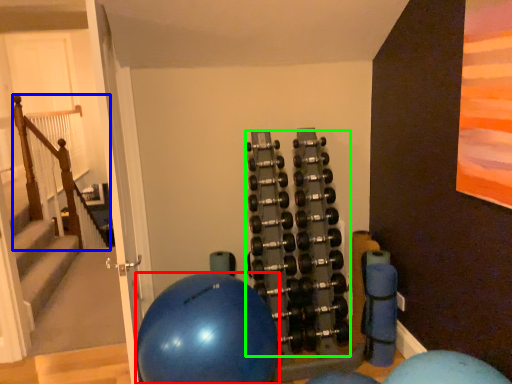
Question: Based on their relative distances, which object is nearer to ball (highlighted by a red box)? Choose from rail (highlighted by a blue box) and dumbbell (highlighted by a green box).

Choices:
 (A) rail
 (B) dumbbell

Answer: (B)